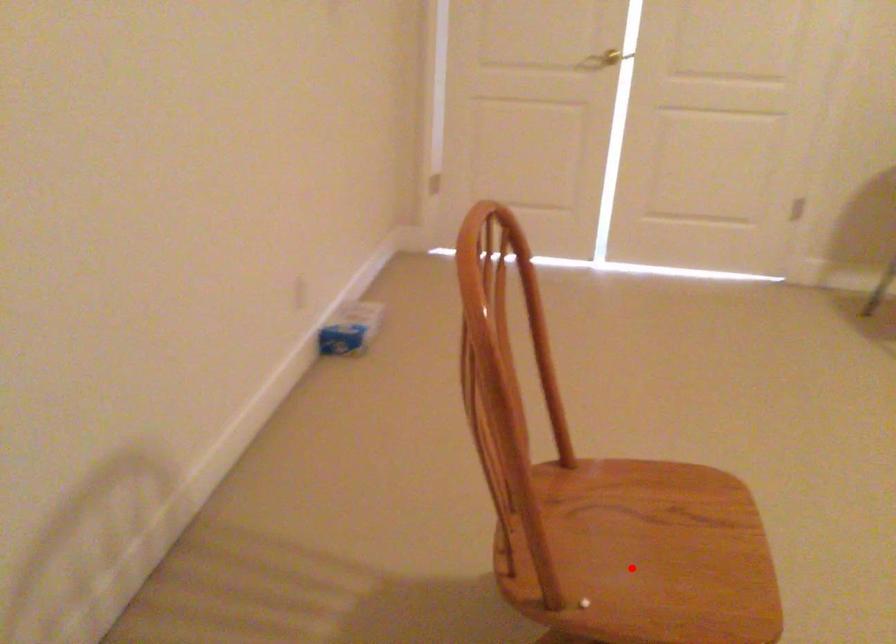
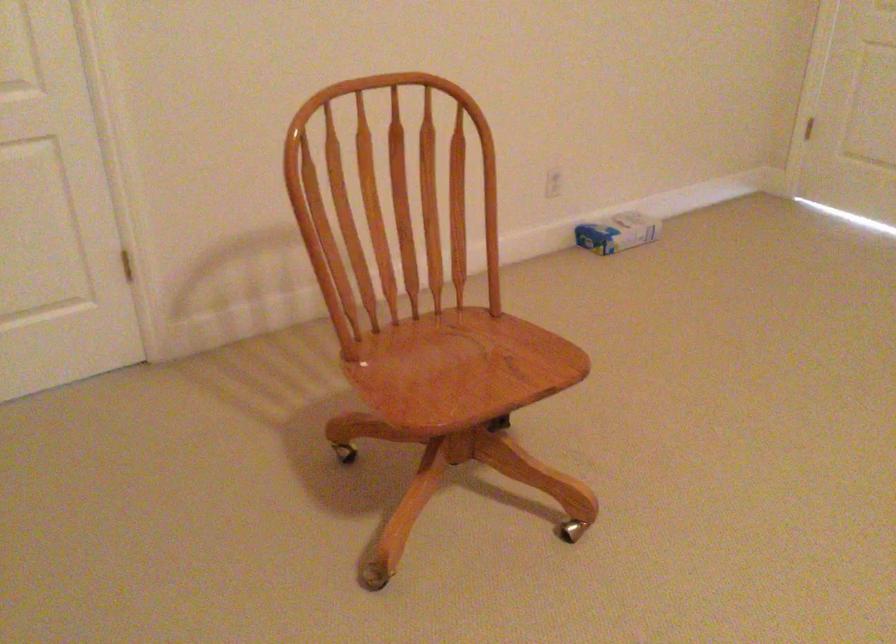
In the second image, find the point that corresponds to the highlighted location in the first image.

(428, 374)